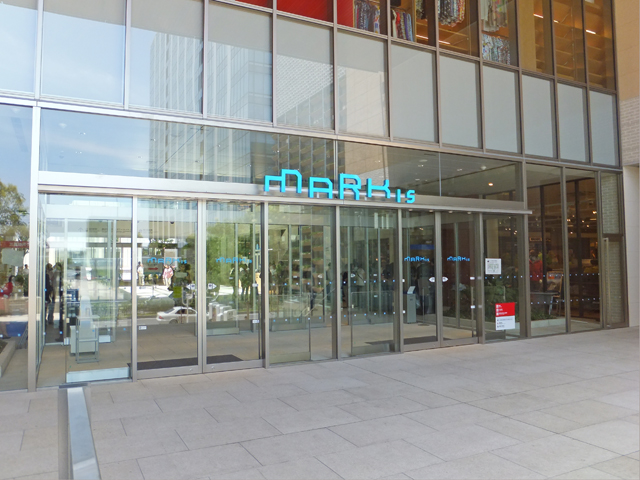
Locate an element on the screen. blue and white small square designs on glass is located at coordinates (543, 302).